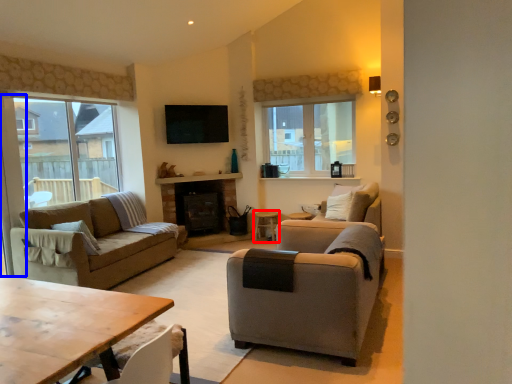
Question: Which point is further to the camera, side table (highlighted by a red box) or screen door (highlighted by a blue box)?

Choices:
 (A) side table
 (B) screen door

Answer: (A)